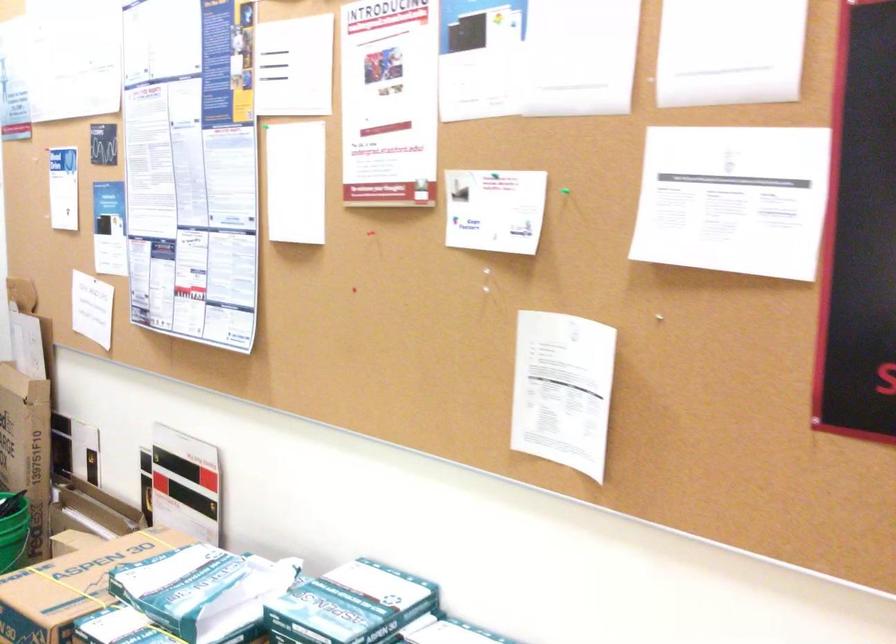
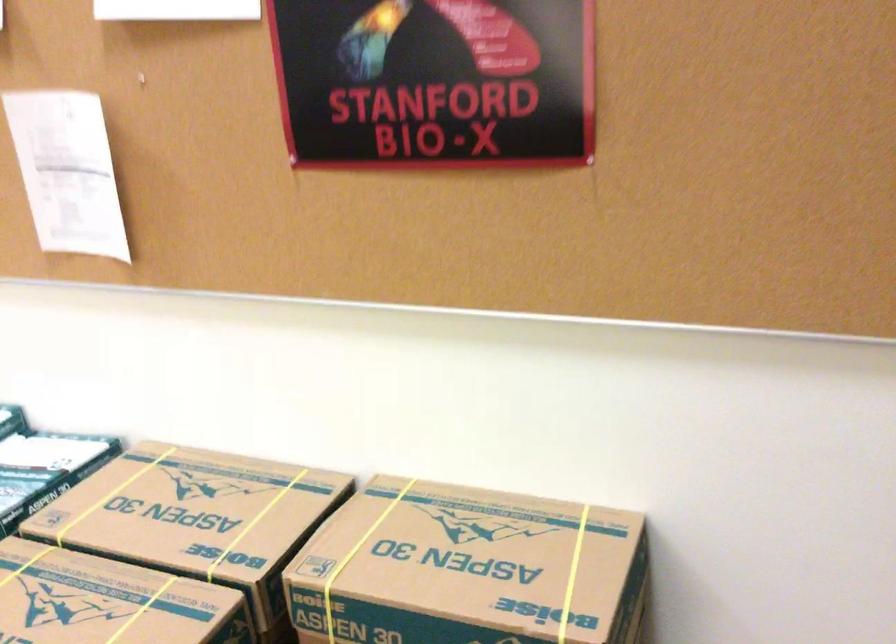
Locate, in the second image, the point that corresponds to (x=819, y=419) in the first image.

(291, 160)